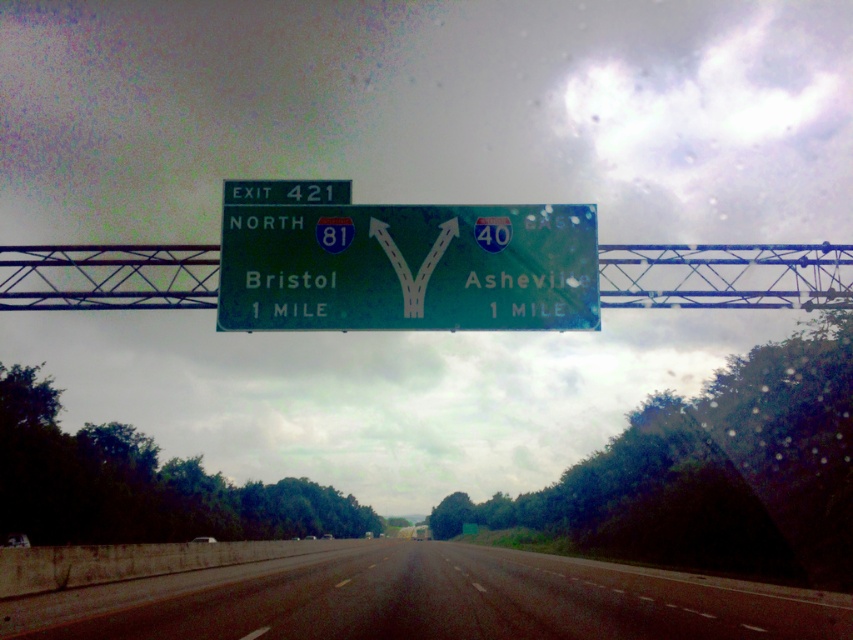
Is black asphalt highway at center wider than green glossy sign at center?

Indeed, black asphalt highway at center has a greater width compared to green glossy sign at center.

This screenshot has width=853, height=640. What do you see at coordinates (428, 602) in the screenshot? I see `black asphalt highway at center` at bounding box center [428, 602].

Is point (492, 589) farther from viewer compared to point (457, 244)?

Yes, point (492, 589) is behind point (457, 244).

This screenshot has width=853, height=640. In order to click on black asphalt highway at center in this screenshot , I will do `click(428, 602)`.